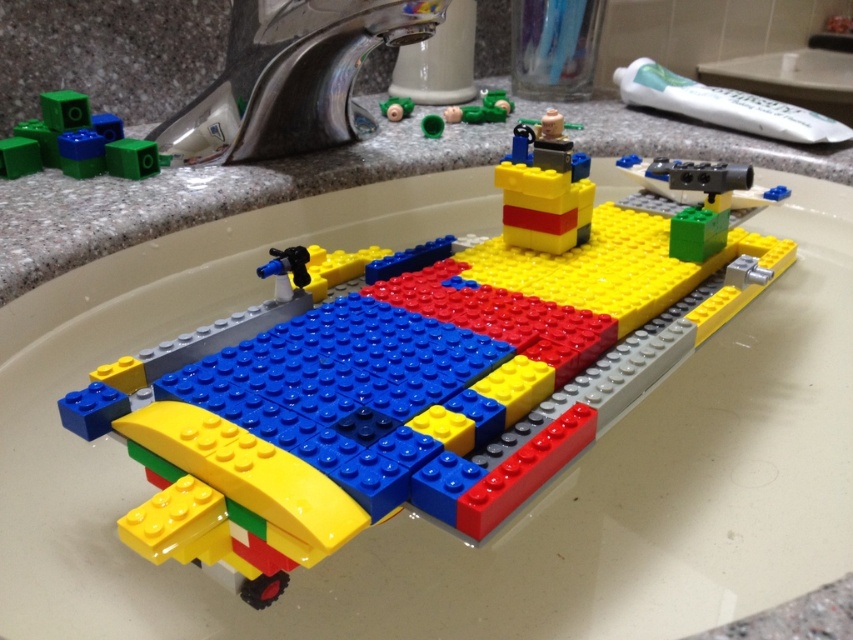
You are trying to clean the sink and need to move the green matte cube at upper left and the matte green plastic toy at upper center. If your hand can reach 18 inches, can you reach both objects without moving your hand position?

The green matte cube at upper left is 18.90 inches from the matte green plastic toy at upper center. Since your hand can only reach 18 inches, you cannot reach both objects without moving your hand position because the distance between them exceeds your reach.

You are standing at the point marked as point (489, 104) in the image. You need to place a LEGO airplane exactly 1.25 meters away from this point. Where should you place it?

You should place the LEGO airplane exactly 1.25 meters away from point (489, 104), as the distance between them needs to be maintained.